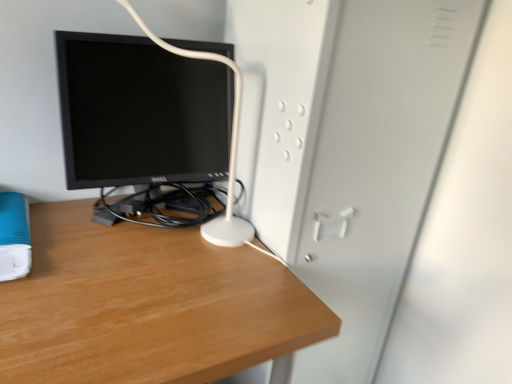
Question: Is white matte file cabinet at center beside blue matte paperback book at lower left?

Choices:
 (A) no
 (B) yes

Answer: (A)

Question: Considering the relative positions of white matte file cabinet at center and blue matte paperback book at lower left in the image provided, is white matte file cabinet at center to the left of blue matte paperback book at lower left from the viewer's perspective?

Choices:
 (A) no
 (B) yes

Answer: (A)

Question: Considering the relative sizes of white matte file cabinet at center and blue matte paperback book at lower left in the image provided, is white matte file cabinet at center shorter than blue matte paperback book at lower left?

Choices:
 (A) yes
 (B) no

Answer: (B)

Question: From the image's perspective, is white matte file cabinet at center above blue matte paperback book at lower left?

Choices:
 (A) no
 (B) yes

Answer: (A)

Question: Is white matte file cabinet at center smaller than blue matte paperback book at lower left?

Choices:
 (A) no
 (B) yes

Answer: (A)

Question: Is wooden desk at center inside or outside of white matte file cabinet at center?

Choices:
 (A) outside
 (B) inside

Answer: (A)

Question: Is wooden desk at center bigger or smaller than white matte file cabinet at center?

Choices:
 (A) big
 (B) small

Answer: (A)

Question: From a real-world perspective, is wooden desk at center above or below white matte file cabinet at center?

Choices:
 (A) below
 (B) above

Answer: (A)

Question: Does point (239, 321) appear closer or farther from the camera than point (369, 218)?

Choices:
 (A) farther
 (B) closer

Answer: (B)

Question: Looking at their shapes, would you say white matte file cabinet at center is wider or thinner than black glossy monitor at center?

Choices:
 (A) thin
 (B) wide

Answer: (B)

Question: Considering the positions of point (360, 317) and point (93, 72), is point (360, 317) closer or farther from the camera than point (93, 72)?

Choices:
 (A) farther
 (B) closer

Answer: (A)

Question: From the image's perspective, is white matte file cabinet at center positioned above or below black glossy monitor at center?

Choices:
 (A) above
 (B) below

Answer: (B)

Question: Considering their positions, is white matte file cabinet at center located in front of or behind black glossy monitor at center?

Choices:
 (A) behind
 (B) front

Answer: (B)

Question: Is black glossy monitor at center bigger or smaller than blue matte paperback book at lower left?

Choices:
 (A) small
 (B) big

Answer: (B)

Question: Is black glossy monitor at center to the left or to the right of blue matte paperback book at lower left in the image?

Choices:
 (A) right
 (B) left

Answer: (A)